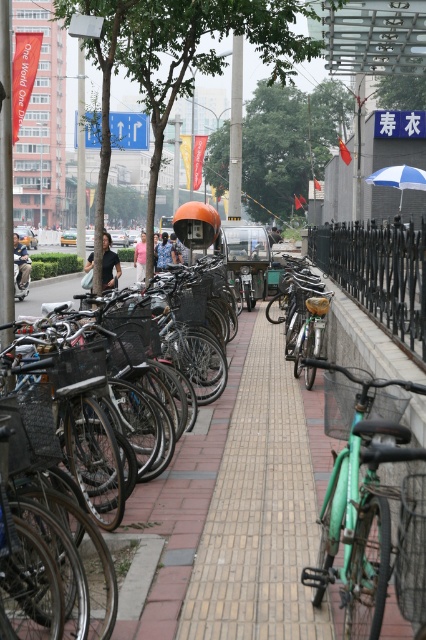
Does metallic silver bicycle at center come in front of black wrought iron fence at right?

That is True.

Is metallic silver bicycle at center taller than black wrought iron fence at right?

Incorrect, metallic silver bicycle at center's height is not larger of black wrought iron fence at right's.

Who is more distant from viewer, (261,577) or (420,328)?

The point (420,328) is more distant.

Image resolution: width=426 pixels, height=640 pixels. In order to click on metallic silver bicycle at center in this screenshot , I will do `click(259, 515)`.

Between black wrought iron fence at right and blue and white striped umbrella at center right, which one appears on the left side from the viewer's perspective?

From the viewer's perspective, black wrought iron fence at right appears more on the left side.

The height and width of the screenshot is (640, 426). What are the coordinates of `black wrought iron fence at right` in the screenshot? It's located at (379, 273).

Which is more to the left, green matte bicycle at center or dark blue jeans at center?

dark blue jeans at center is more to the left.

Between green matte bicycle at center and dark blue jeans at center, which one appears on the right side from the viewer's perspective?

green matte bicycle at center

Is point (333, 550) in front of point (25, 284)?

Yes.

What are the coordinates of `green matte bicycle at center` in the screenshot? It's located at (359, 497).